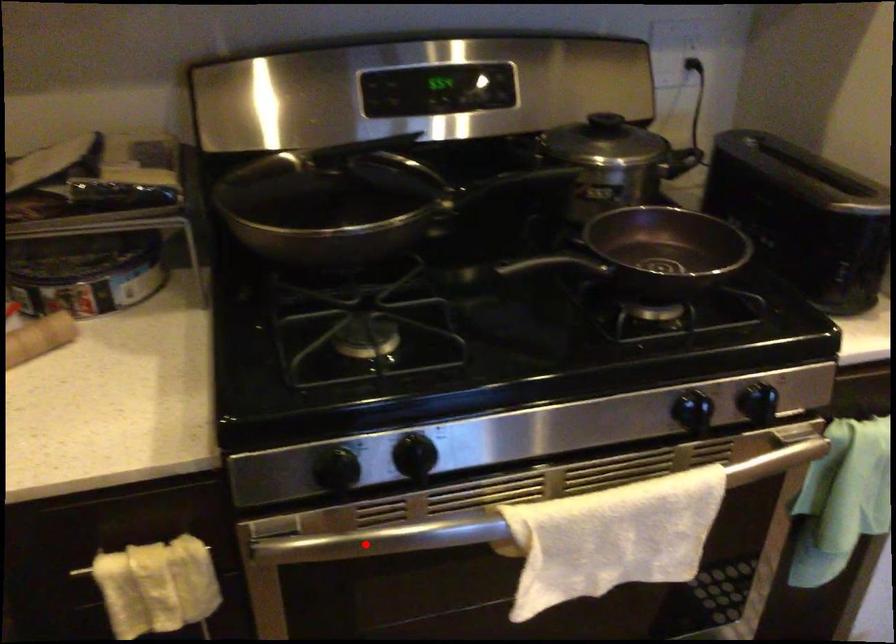
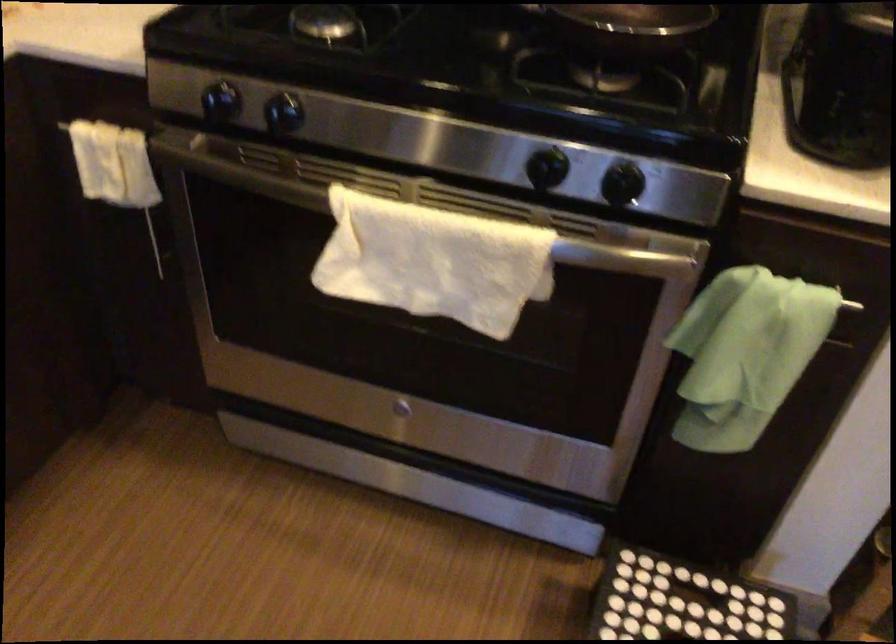
The point at the highlighted location is marked in the first image. Where is the corresponding point in the second image?

(235, 172)